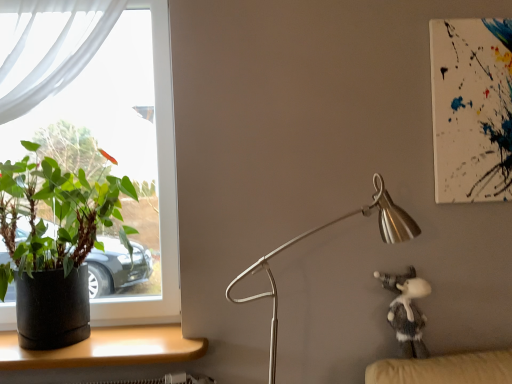
I want to click on fuzzy gray plush at lower right, so click(x=406, y=310).

What do you see at coordinates (53, 247) in the screenshot? I see `black matte pot at left` at bounding box center [53, 247].

What do you see at coordinates (106, 349) in the screenshot? This screenshot has width=512, height=384. I see `wooden desk at lower left` at bounding box center [106, 349].

The image size is (512, 384). What do you see at coordinates (119, 161) in the screenshot? I see `clear glass window at left` at bounding box center [119, 161].

Locate an element on the screen. fuzzy gray plush at lower right is located at coordinates (406, 310).

Is point (121, 351) closer or farther from the camera than point (393, 307)?

Point (121, 351).

Considering the positions of objects wooden desk at lower left and fuzzy gray plush at lower right in the image provided, who is in front, wooden desk at lower left or fuzzy gray plush at lower right?

wooden desk at lower left is in front.

Considering the sizes of objects wooden desk at lower left and fuzzy gray plush at lower right in the image provided, who is taller, wooden desk at lower left or fuzzy gray plush at lower right?

fuzzy gray plush at lower right is taller.

Is wooden desk at lower left facing towards fuzzy gray plush at lower right?

No, wooden desk at lower left is not oriented towards fuzzy gray plush at lower right.

From a real-world perspective, is black matte pot at left physically located above or below fuzzy gray plush at lower right?

Answer: black matte pot at left is above fuzzy gray plush at lower right.

Could you tell me if black matte pot at left is facing fuzzy gray plush at lower right?

No, black matte pot at left is not turned towards fuzzy gray plush at lower right.

Is black matte pot at left taller than fuzzy gray plush at lower right?

Yes.

This screenshot has height=384, width=512. Find the location of `toy below the black matte pot at left (from the image's perspective)`. toy below the black matte pot at left (from the image's perspective) is located at coordinates (406, 310).

Could you tell me if silver metallic lamp at center-right is facing black matte pot at left?

No.

Identify the location of lamp on the right of the black matte pot at left. The width and height of the screenshot is (512, 384). (324, 228).

Based on the photo, from a real-world perspective, is silver metallic lamp at center-right above or below black matte pot at left?

Clearly, from a real-world perspective, silver metallic lamp at center-right is below black matte pot at left.

What's the angular difference between silver metallic lamp at center-right and black matte pot at left's facing directions?

silver metallic lamp at center-right and black matte pot at left are facing 0.989 degrees away from each other.

Is silver metallic lamp at center-right spatially inside fuzzy gray plush at lower right, or outside of it?

silver metallic lamp at center-right is not enclosed by fuzzy gray plush at lower right.

Does silver metallic lamp at center-right come in front of fuzzy gray plush at lower right?

Yes.

Is silver metallic lamp at center-right positioned with its back to fuzzy gray plush at lower right?

Yes, silver metallic lamp at center-right is positioned with its back facing fuzzy gray plush at lower right.

Does silver metallic lamp at center-right have a lesser width compared to fuzzy gray plush at lower right?

No.

Is silver metallic lamp at center-right shorter than clear glass window at left?

Correct, silver metallic lamp at center-right is not as tall as clear glass window at left.

Is point (407, 231) closer to viewer compared to point (94, 174)?

Yes, point (407, 231) is closer to viewer.

Are silver metallic lamp at center-right and clear glass window at left located far from each other?

No, there isn't a large distance between silver metallic lamp at center-right and clear glass window at left.

How different are the orientations of silver metallic lamp at center-right and clear glass window at left in degrees?

They differ by 0.202 degrees in their facing directions.

Based on the photo, based on their sizes in the image, would you say black matte pot at left is bigger or smaller than clear glass window at left?

black matte pot at left is smaller than clear glass window at left.

Does black matte pot at left lie in front of clear glass window at left?

Yes.

Is black matte pot at left wider than clear glass window at left?

Correct, the width of black matte pot at left exceeds that of clear glass window at left.

Does point (84, 201) lie behind point (168, 244)?

No, (84, 201) is closer to viewer.

Where is `window behind the fuzzy gray plush at lower right`? The width and height of the screenshot is (512, 384). window behind the fuzzy gray plush at lower right is located at coordinates (119, 161).

Would you say clear glass window at left is to the left or to the right of fuzzy gray plush at lower right in the picture?

Clearly, clear glass window at left is on the left of fuzzy gray plush at lower right in the image.

Is clear glass window at left smaller than fuzzy gray plush at lower right?

No, clear glass window at left is not smaller than fuzzy gray plush at lower right.

Find the location of a particular element. This screenshot has width=512, height=384. desk below the fuzzy gray plush at lower right (from the image's perspective) is located at coordinates (106, 349).

Locate an element on the screen. Image resolution: width=512 pixels, height=384 pixels. toy lying behind the black matte pot at left is located at coordinates (406, 310).

Looking at this image, estimate the real-world distances between objects in this image. Which object is closer to silver metallic lamp at center-right, clear glass window at left or wooden desk at lower left?

Based on the image, wooden desk at lower left appears to be nearer to silver metallic lamp at center-right.

Which object lies further to the anchor point black matte pot at left, fuzzy gray plush at lower right or silver metallic lamp at center-right?

fuzzy gray plush at lower right is positioned further to the anchor black matte pot at left.

Looking at the image, which one is located further to clear glass window at left, wooden desk at lower left or fuzzy gray plush at lower right?

Based on the image, fuzzy gray plush at lower right appears to be further to clear glass window at left.

From the image, which object appears to be farther from fuzzy gray plush at lower right, wooden desk at lower left or black matte pot at left?

Based on the image, black matte pot at left appears to be further to fuzzy gray plush at lower right.

Estimate the real-world distances between objects in this image. Which object is further from silver metallic lamp at center-right, black matte pot at left or fuzzy gray plush at lower right?

Among the two, black matte pot at left is located further to silver metallic lamp at center-right.

From the picture: From the image, which object appears to be nearer to wooden desk at lower left, clear glass window at left or fuzzy gray plush at lower right?

Based on the image, clear glass window at left appears to be nearer to wooden desk at lower left.

Estimate the real-world distances between objects in this image. Which object is further from black matte pot at left, fuzzy gray plush at lower right or wooden desk at lower left?

fuzzy gray plush at lower right lies further to black matte pot at left than the other object.

Estimate the real-world distances between objects in this image. Which object is further from black matte pot at left, wooden desk at lower left or fuzzy gray plush at lower right?

The object further to black matte pot at left is fuzzy gray plush at lower right.

Find the location of `lamp located between black matte pot at left and fuzzy gray plush at lower right in the left-right direction`. lamp located between black matte pot at left and fuzzy gray plush at lower right in the left-right direction is located at coordinates (324, 228).

Locate an element on the screen. The height and width of the screenshot is (384, 512). houseplant between clear glass window at left and wooden desk at lower left in the up-down direction is located at coordinates [53, 247].

Find the location of a particular element. desk situated between black matte pot at left and fuzzy gray plush at lower right from left to right is located at coordinates (106, 349).

I want to click on houseplant between clear glass window at left and silver metallic lamp at center-right, so click(53, 247).